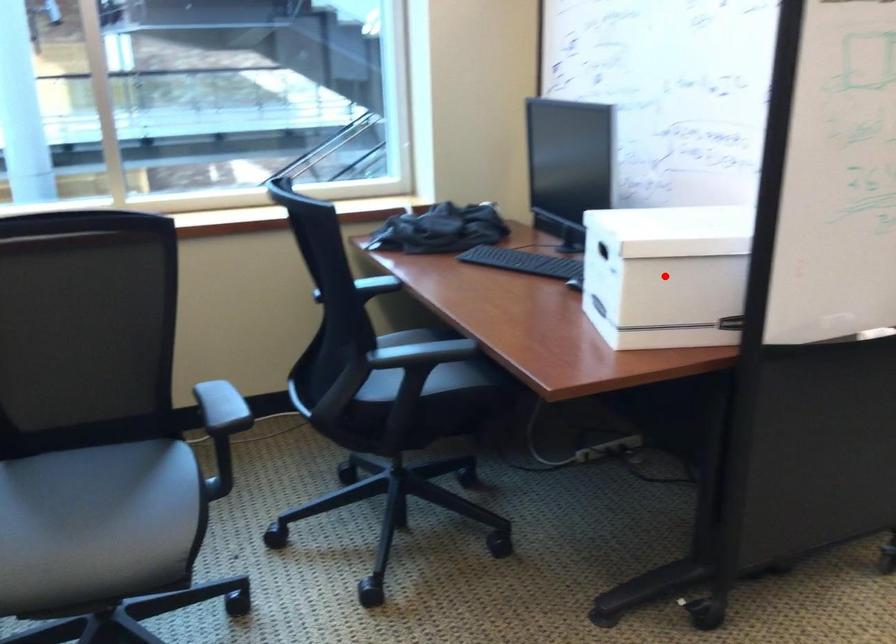
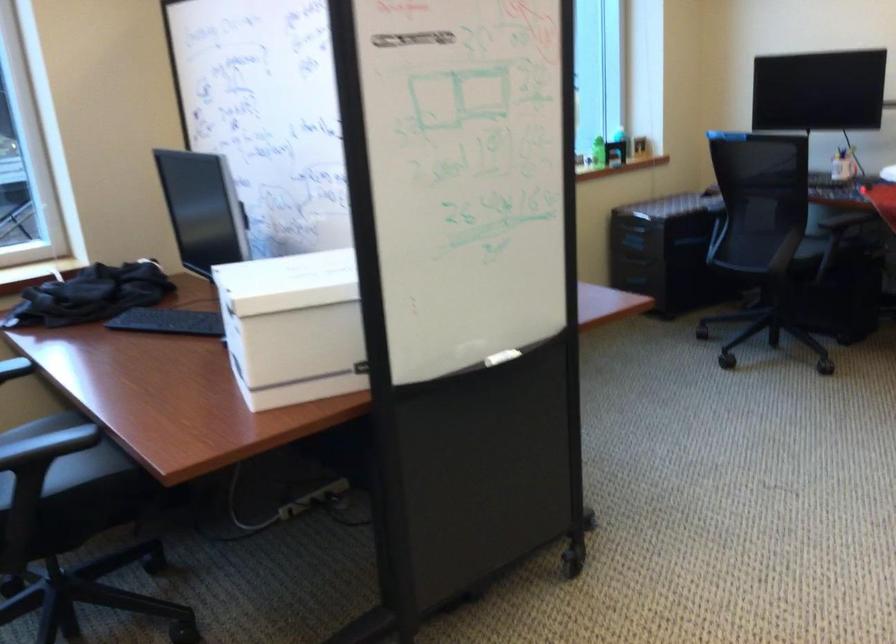
Find the pixel in the second image that matches the highlighted location in the first image.

(293, 327)